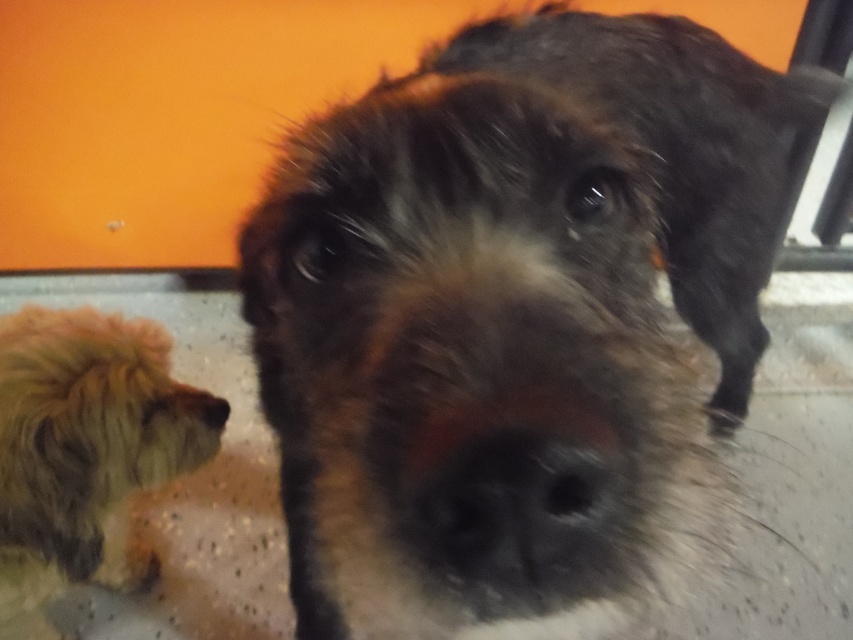
Question: Is brown fuzzy dog at center above brown fuzzy nose at lower left?

Choices:
 (A) no
 (B) yes

Answer: (B)

Question: Is brown fuzzy dog at center wider than brown fuzzy nose at lower left?

Choices:
 (A) no
 (B) yes

Answer: (B)

Question: Among these objects, which one is nearest to the camera?

Choices:
 (A) fuzzy brown dog at lower left
 (B) brown fuzzy nose at lower left
 (C) brown fuzzy dog at center

Answer: (C)

Question: Among these objects, which one is farthest from the camera?

Choices:
 (A) brown fuzzy dog at center
 (B) fuzzy brown dog at lower left
 (C) brown fuzzy nose at lower left

Answer: (C)

Question: Which of these objects is positioned closest to the fuzzy brown dog at lower left?

Choices:
 (A) brown fuzzy dog at center
 (B) brown fuzzy nose at lower left

Answer: (B)

Question: Can you confirm if brown fuzzy dog at center is smaller than brown fuzzy nose at lower left?

Choices:
 (A) no
 (B) yes

Answer: (A)